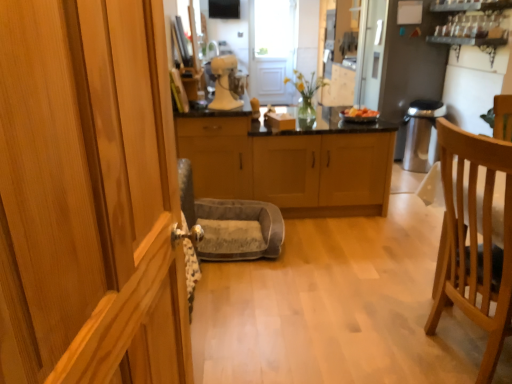
I want to click on vacant area that lies in front of velvet gray pet bed at center, so click(259, 281).